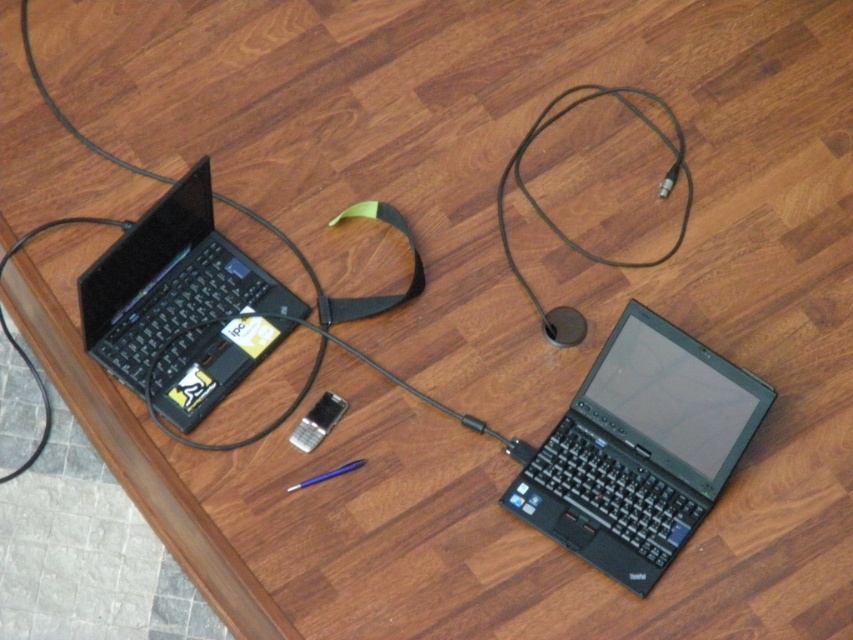
Is black matte laptop at lower right behind black matte laptop at left?

Yes, it is.

Between black matte laptop at lower right and black matte laptop at left, which one is positioned lower?

black matte laptop at lower right

Between point (598, 461) and point (125, 282), which one is positioned in front?

Point (125, 282) is more forward.

The height and width of the screenshot is (640, 853). Identify the location of black matte laptop at lower right. (640, 449).